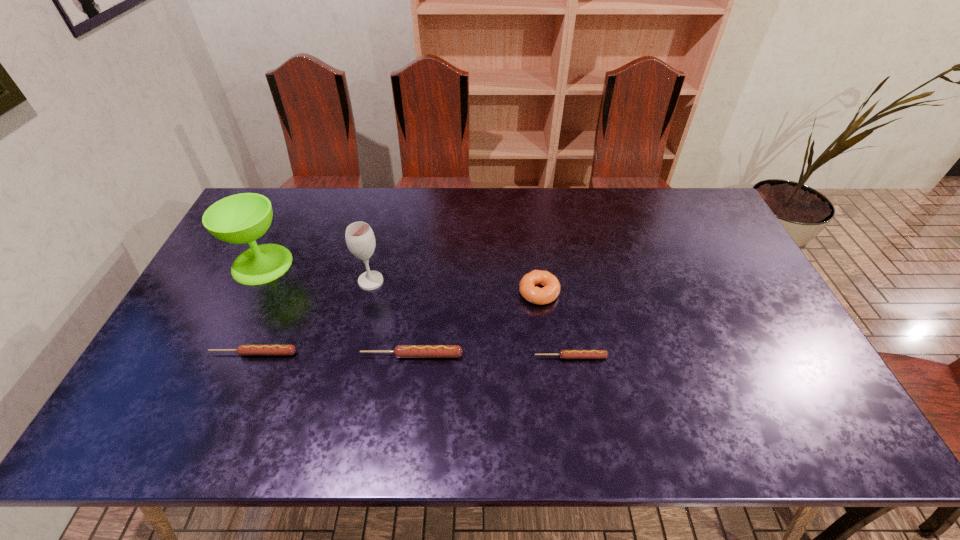
The image size is (960, 540). I want to click on vacant space in between the left wineglass and the second shortest object, so click(x=258, y=308).

You are a GUI agent. You are given a task and a screenshot of the screen. Output one action in this format:
    pyautogui.click(x=<x>, y=<y>)
    Task: Click on the empty space that is in between the second sausage from right to left and the rightmost sausage
    This screenshot has width=960, height=540.
    Given the screenshot: What is the action you would take?
    pyautogui.click(x=492, y=356)

Image resolution: width=960 pixels, height=540 pixels. What are the coordinates of `object identified as the second closest to the right wineglass` in the screenshot? It's located at (242, 218).

Find the location of `object that is the closest to the fourth shortest object`. object that is the closest to the fourth shortest object is located at coordinates (564, 354).

Identify which sausage is the second closest to the right wineglass. Please provide its 2D coordinates. Your answer should be formatted as a tuple, i.e. [(x, y)], where the tuple contains the x and y coordinates of a point satisfying the conditions above.

[(241, 349)]

At what (x,y) coordinates should I click in order to perform the action: click on sausage that is the closest one to the right wineglass. Please return your answer as a coordinate pair (x, y). Looking at the image, I should click on (401, 351).

Where is `vacant space that satisfies the following two spatial constraints: 1. on the front side of the right wineglass; 2. on the right side of the second sausage from right to left`? The height and width of the screenshot is (540, 960). vacant space that satisfies the following two spatial constraints: 1. on the front side of the right wineglass; 2. on the right side of the second sausage from right to left is located at coordinates (353, 355).

Find the location of a particular element. This screenshot has width=960, height=540. vacant space that satisfies the following two spatial constraints: 1. on the front side of the second sausage from left to right; 2. on the left side of the right wineglass is located at coordinates (353, 355).